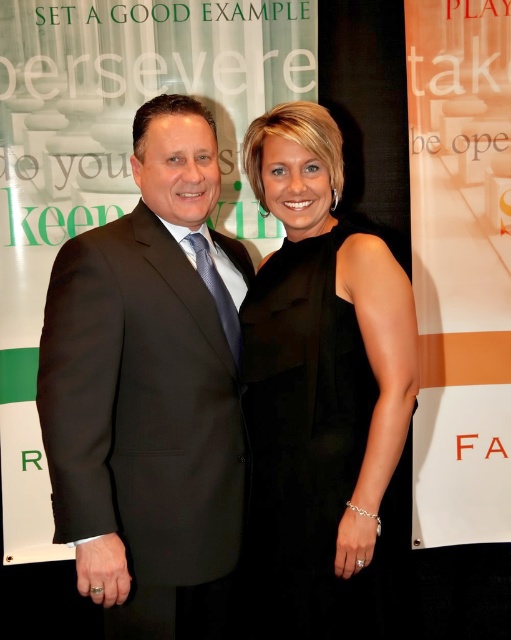
Question: Which of the following is the farthest from the observer?

Choices:
 (A) black satin dress at center
 (B) black satin suit at center

Answer: (A)

Question: Which point appears closest to the camera in this image?

Choices:
 (A) (327, 426)
 (B) (211, 465)

Answer: (B)

Question: Can you confirm if black satin suit at center is positioned above black satin dress at center?

Choices:
 (A) no
 (B) yes

Answer: (B)

Question: Is black satin suit at center smaller than black satin dress at center?

Choices:
 (A) yes
 (B) no

Answer: (A)

Question: Which point is closer to the camera?

Choices:
 (A) black satin dress at center
 (B) black satin suit at center

Answer: (B)

Question: Is black satin suit at center above black satin dress at center?

Choices:
 (A) yes
 (B) no

Answer: (A)